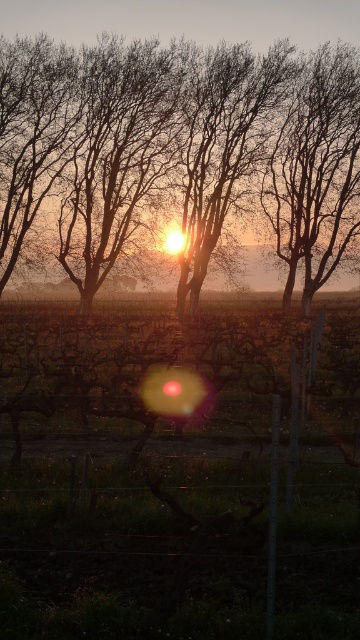
Does silhouette bark tree at center appear on the right side of smooth bark tree at center?

No, silhouette bark tree at center is not to the right of smooth bark tree at center.

Can you confirm if silhouette bark tree at center is thinner than smooth bark tree at center?

No.

What do you see at coordinates (177, 150) in the screenshot?
I see `silhouette bark tree at center` at bounding box center [177, 150].

Identify the location of silhouette bark tree at center. (177, 150).